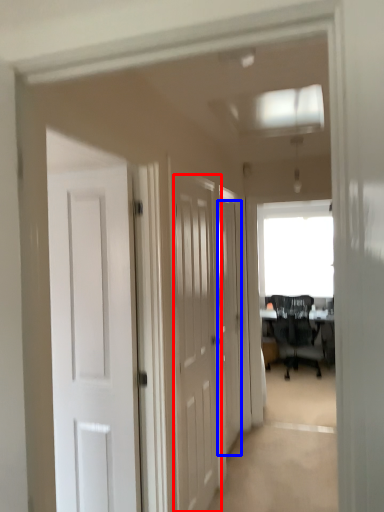
Question: Among these objects, which one is nearest to the camera, door (highlighted by a red box) or door (highlighted by a blue box)?

Choices:
 (A) door
 (B) door

Answer: (A)